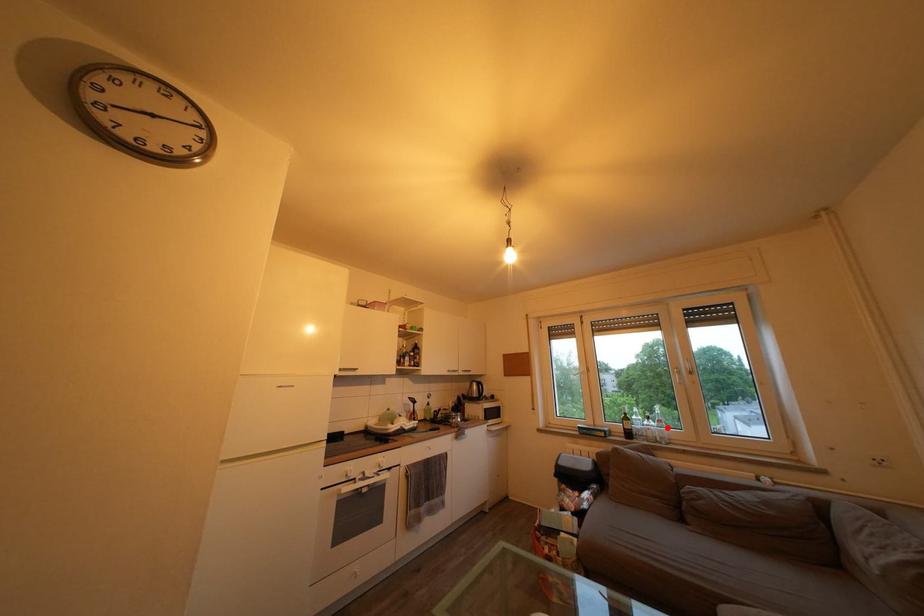
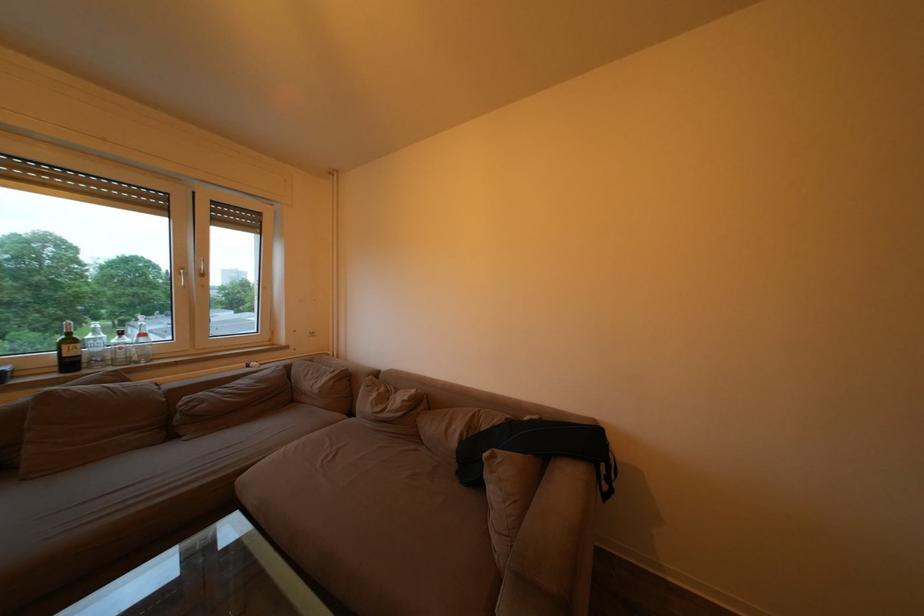
Question: I am providing you with two images of the same scene from different viewpoints. A red point is shown in image1. For the corresponding object point in image2, is it positioned nearer or farther from the camera?

Choices:
 (A) Nearer
 (B) Farther

Answer: (A)